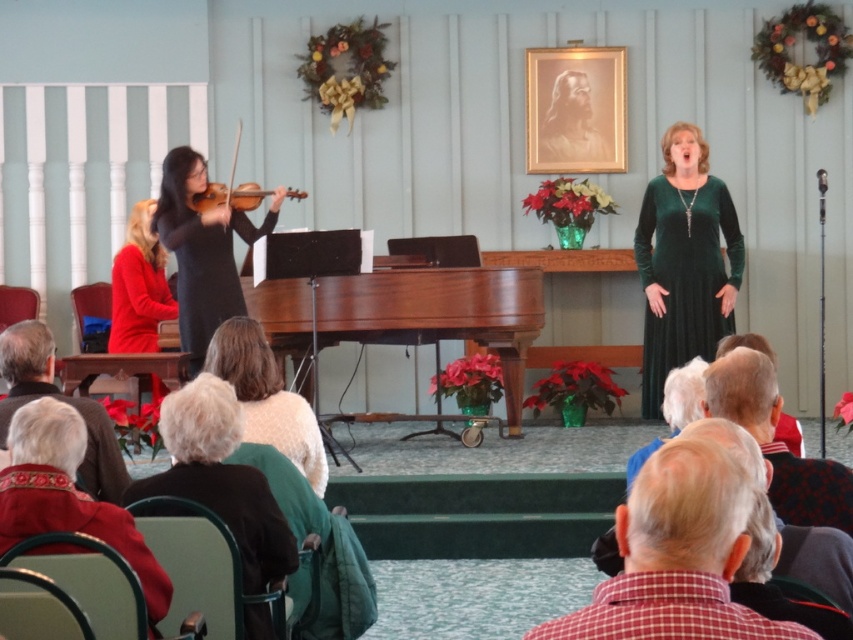
You are a photographer setting up for a performance. You need to position a light so it illuminates both the plaid shirt at lower right and the black matte violin at left without casting shadows. Given their positions, which object should the light be placed closer to?

The plaid shirt at lower right is in front of the black matte violin at left, so the light should be placed closer to the black matte violin at left to avoid shadows from the plaid shirt blocking the light.

You are an audience member sitting in the front row. You notice the black matte violin at left and the white fuzzy sweater at lower center. Which object is positioned more to the left side of the stage?

The black matte violin at left is positioned more to the left side of the stage than the white fuzzy sweater at lower center.